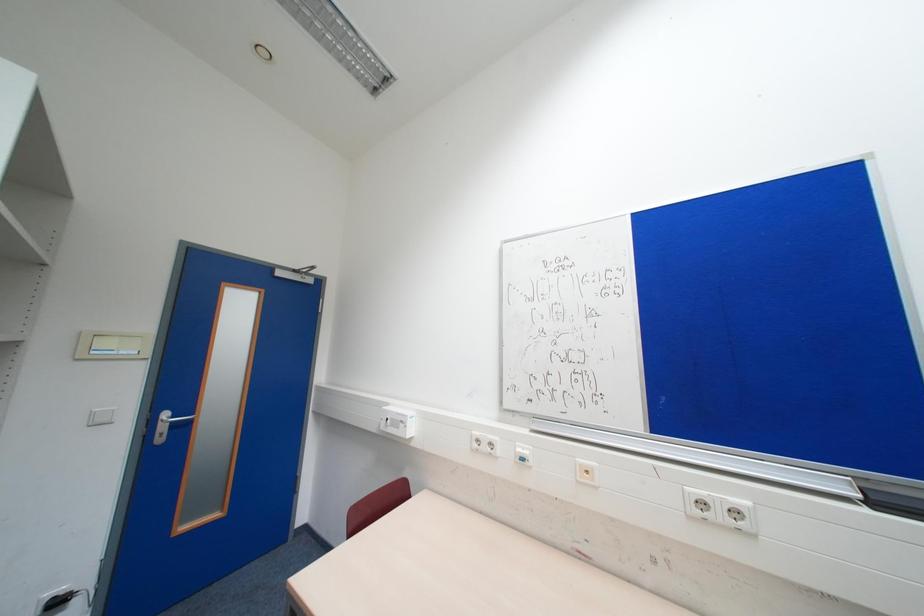
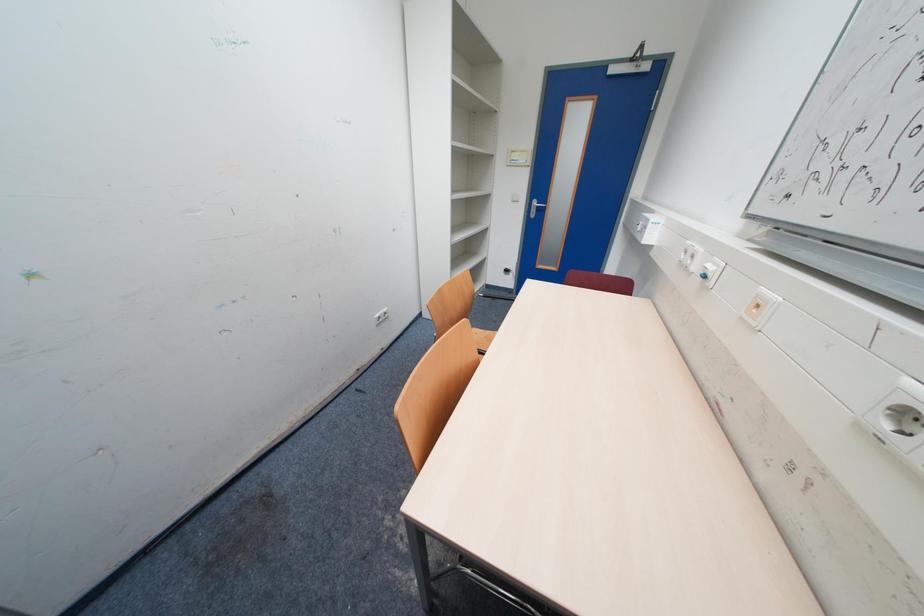
The images are taken continuously from a first-person perspective. In which direction is your viewpoint rotating?

The camera rotated toward left-down.